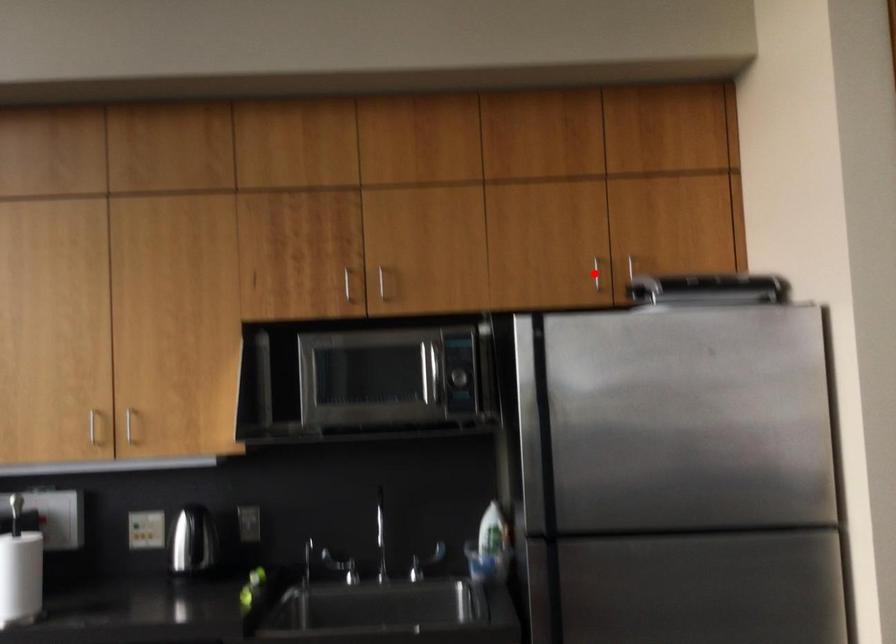
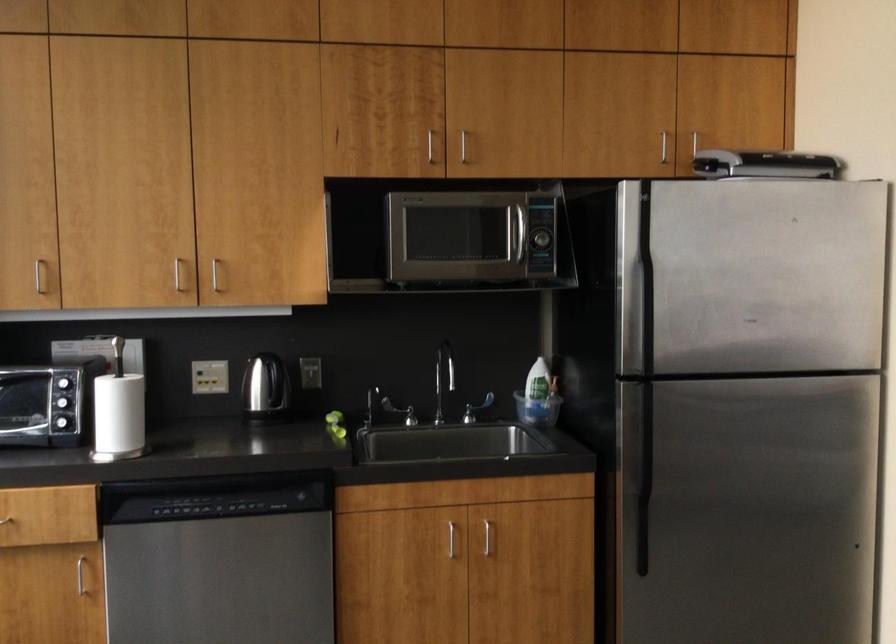
Where in the second image is the point corresponding to the highlighted location from the first image?

(662, 147)